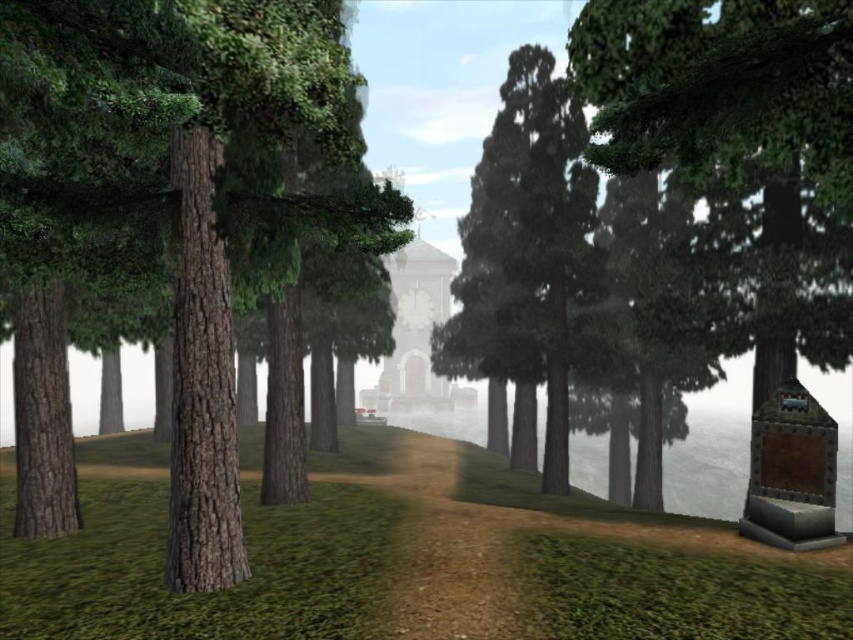
You are a hiker carrying a 5.5 meter long wooden beam. You want to place the beam horizontally between the smooth brown tree trunk at left and the green textured tree at right. Will the beam fit perfectly between them?

The smooth brown tree trunk at left and the green textured tree at right are 5.52 meters apart, so the 5.5 meter long wooden beam will fit perfectly between them with a small gap remaining.

You are a hiker trying to determine which tree to use for a makeshift shelter. You have two options in the forest scene described. Which tree has a thicker trunk, the smooth brown tree trunk at left or the green textured tree at right?

The green textured tree at right has a thicker trunk than the smooth brown tree trunk at left.